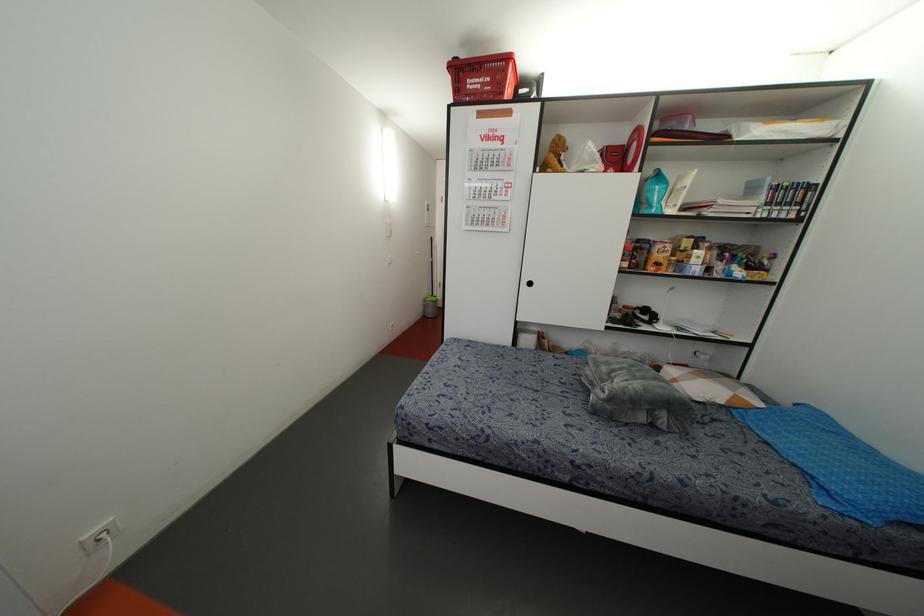
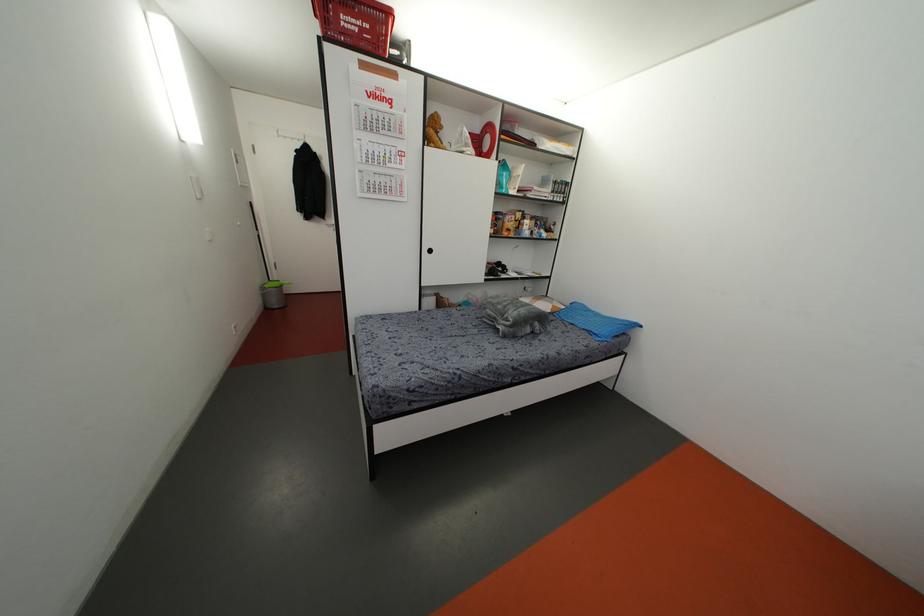
Question: How did the camera likely rotate?

Choices:
 (A) Left
 (B) Right
 (C) Up
 (D) Down

Answer: (B)